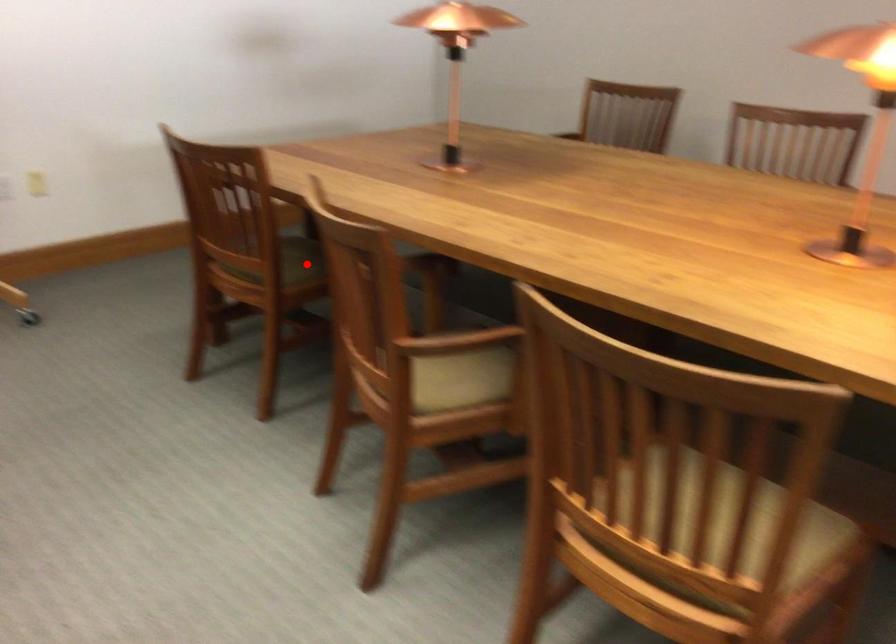
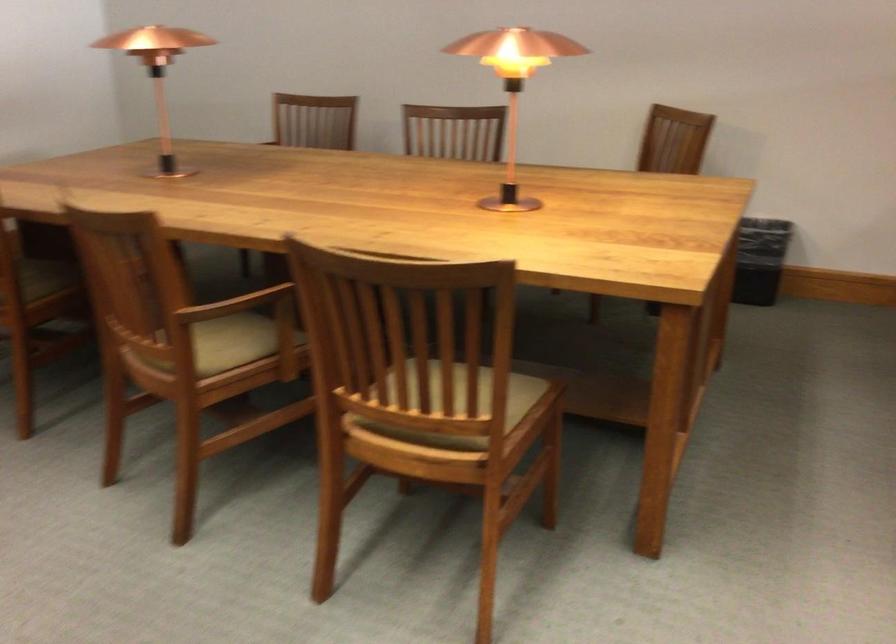
Where in the second image is the point corresponding to the highlighted location from the first image?

(44, 279)